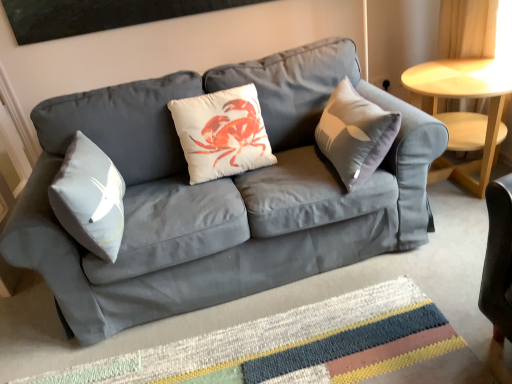
Question: Based on their sizes in the image, would you say white matte cushion at center is bigger or smaller than matte gray couch at center?

Choices:
 (A) small
 (B) big

Answer: (A)

Question: In terms of height, does white matte cushion at center look taller or shorter compared to matte gray couch at center?

Choices:
 (A) tall
 (B) short

Answer: (B)

Question: Considering the real-world distances, which object is closest to the white matte cushion at center?

Choices:
 (A) matte gray couch at center
 (B) light wood/finished table at right
 (C) multicolored woven mat at center

Answer: (A)

Question: Which of these objects is positioned closest to the white matte cushion at center?

Choices:
 (A) matte gray couch at center
 (B) multicolored woven mat at center
 (C) light wood/finished table at right

Answer: (A)